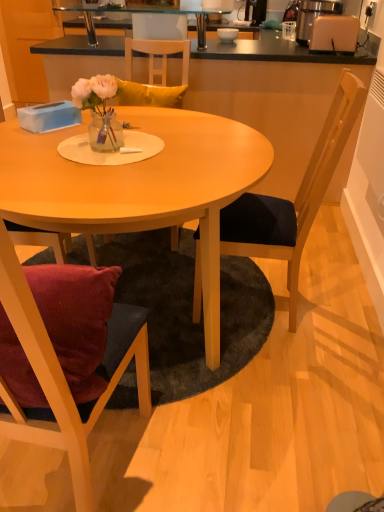
Question: Considering the positions of smooth black countertop at upper center and white plastic toaster at upper right in the image, is smooth black countertop at upper center bigger or smaller than white plastic toaster at upper right?

Choices:
 (A) small
 (B) big

Answer: (B)

Question: From the image's perspective, is smooth black countertop at upper center located above or below white plastic toaster at upper right?

Choices:
 (A) below
 (B) above

Answer: (A)

Question: Estimate the real-world distances between objects in this image. Which object is farther from the black fabric chair at right, the 2th chair viewed from the left?

Choices:
 (A) translucent glass vase at center
 (B) black glass shelf at upper center
 (C) metallic silver coffee machine at upper center
 (D) matte white bowl at upper center
 (E) wooden chair at upper center

Answer: (B)

Question: Estimate the real-world distances between objects in this image. Which object is closer to the translucent glass vase at center?

Choices:
 (A) black fabric chair at right, the 2th chair viewed from the left
 (B) matte white bowl at upper center
 (C) metallic silver coffee machine at upper center
 (D) transparent glass table at upper center
 (E) wooden chair at left, marked as the 1th chair in a left-to-right arrangement

Answer: (A)